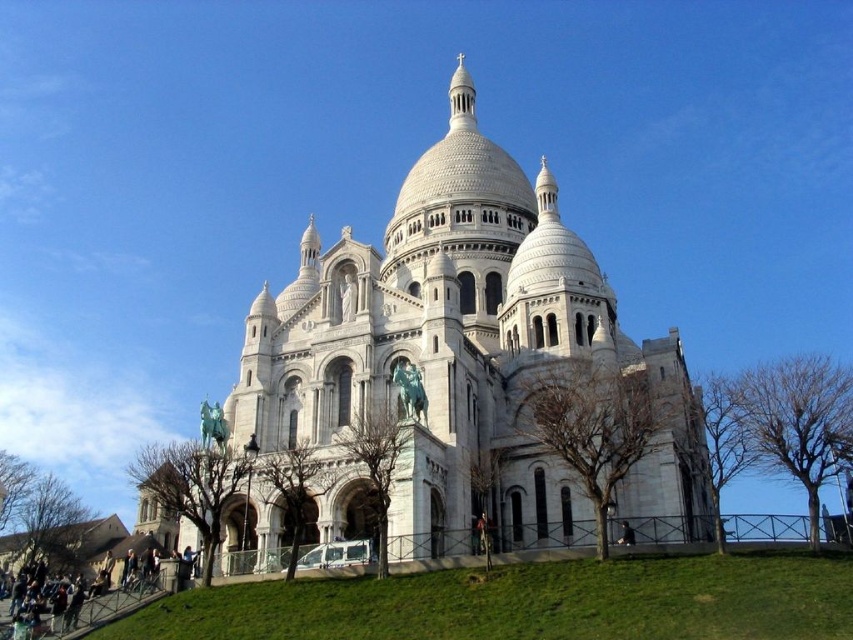
Question: Does white stone church at center have a larger size compared to green grass at lower center?

Choices:
 (A) no
 (B) yes

Answer: (B)

Question: Which object appears farthest from the camera in this image?

Choices:
 (A) green grass at lower center
 (B) white stone church at center

Answer: (B)

Question: In this image, where is white stone church at center located relative to green grass at lower center?

Choices:
 (A) below
 (B) above

Answer: (B)

Question: Is white stone church at center behind green grass at lower center?

Choices:
 (A) no
 (B) yes

Answer: (B)